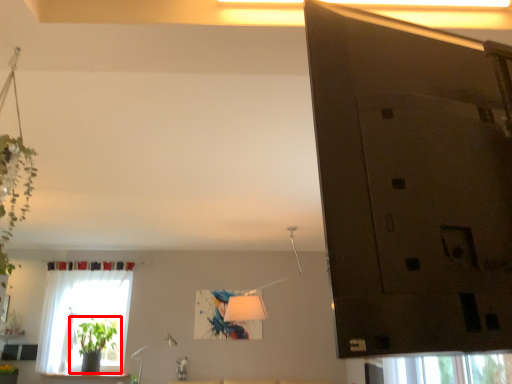
Question: From the image's perspective, considering the relative positions of houseplant (annotated by the red box) and window in the image provided, where is houseplant (annotated by the red box) located with respect to the staircase?

Choices:
 (A) above
 (B) below

Answer: (B)